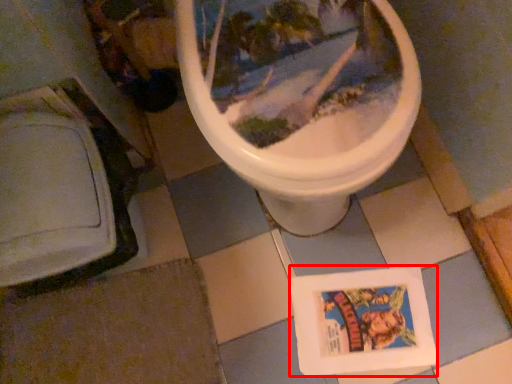
Question: From the image's perspective, what is the correct spatial positioning of comic book (annotated by the red box) in reference to tile?

Choices:
 (A) below
 (B) above

Answer: (B)